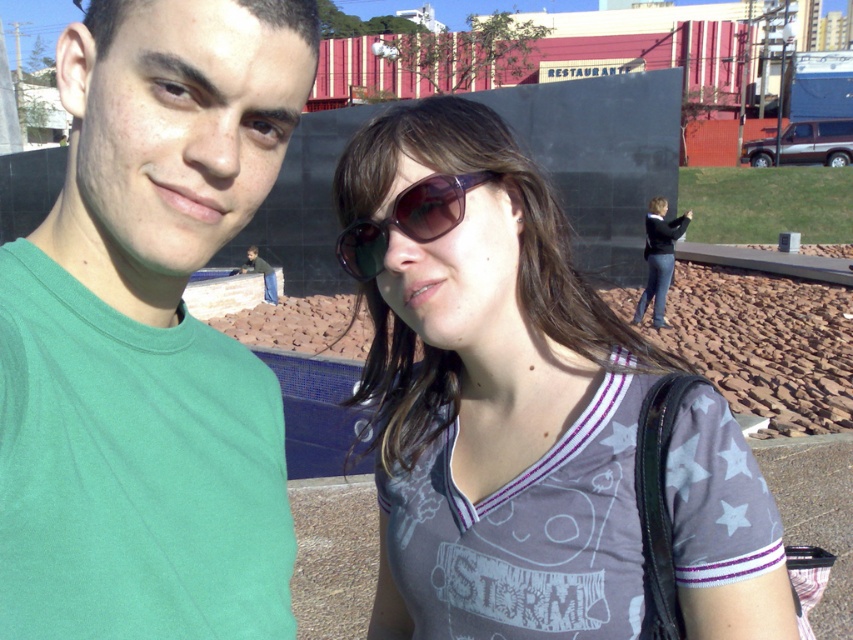
Who is taller, matte gray shirt at center or sunglasses at center?

With more height is matte gray shirt at center.

Is point (706, 540) positioned after point (357, 275)?

No, it is in front of (357, 275).

Where is `matte gray shirt at center`? Image resolution: width=853 pixels, height=640 pixels. matte gray shirt at center is located at coordinates (489, 388).

Between point (74, 168) and point (427, 150), which one is positioned in front?

Point (74, 168) is in front.

Identify the location of green matte t-shirt at left. (148, 340).

Between point (125, 230) and point (398, 227), which one is positioned in front?

Point (125, 230) is more forward.

The width and height of the screenshot is (853, 640). Describe the element at coordinates (148, 340) in the screenshot. I see `green matte t-shirt at left` at that location.

You are a GUI agent. You are given a task and a screenshot of the screen. Output one action in this format:
    pyautogui.click(x=<x>, y=<y>)
    Task: Click on the green matte t-shirt at left
    This screenshot has width=853, height=640.
    Given the screenshot: What is the action you would take?
    pyautogui.click(x=148, y=340)